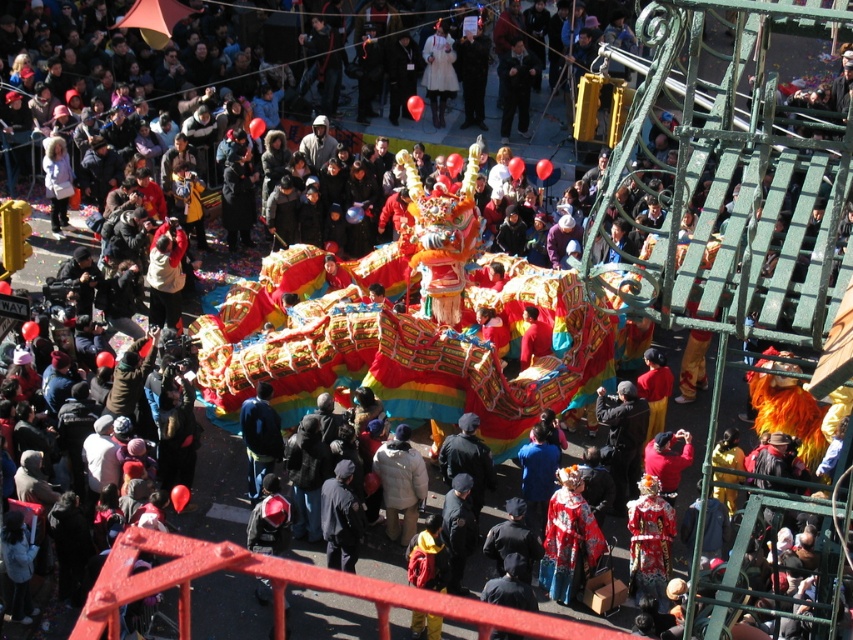
You are a photographer at the parade and want to capture both the embroidered silk costume at center and the white puffy coat at center in a single shot. Which costume should you position your camera to the left of to ensure both are in frame?

You should position your camera to the left of the white puffy coat at center. Since the embroidered silk costume at center is to the right of the white puffy coat at center, this positioning will ensure both are included in the frame.

You are a photographer trying to capture the dragon float. You notice a red satin costume at center and a dark gray fabric jacket at center in your frame. Which clothing item takes up more space horizontally in the photo?

The red satin costume at center takes up more horizontal space in the photo because its width surpasses that of the dark gray fabric jacket at center.

Based on the photo, you are standing at the camera position observing the parade float. There is a specific point marked at coordinates point (380,451). Can you safely walk towards that point without getting too close to the float or the crowd?

The point (380,451) is 143.10 feet away from the camera, so yes, you can safely walk towards it without getting too close to the float or the crowd since the distance is sufficient.